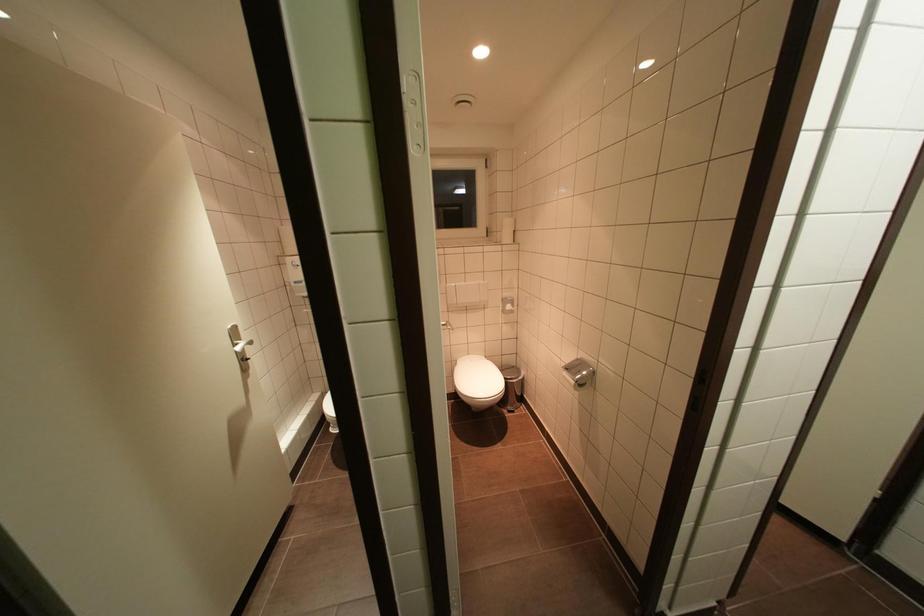
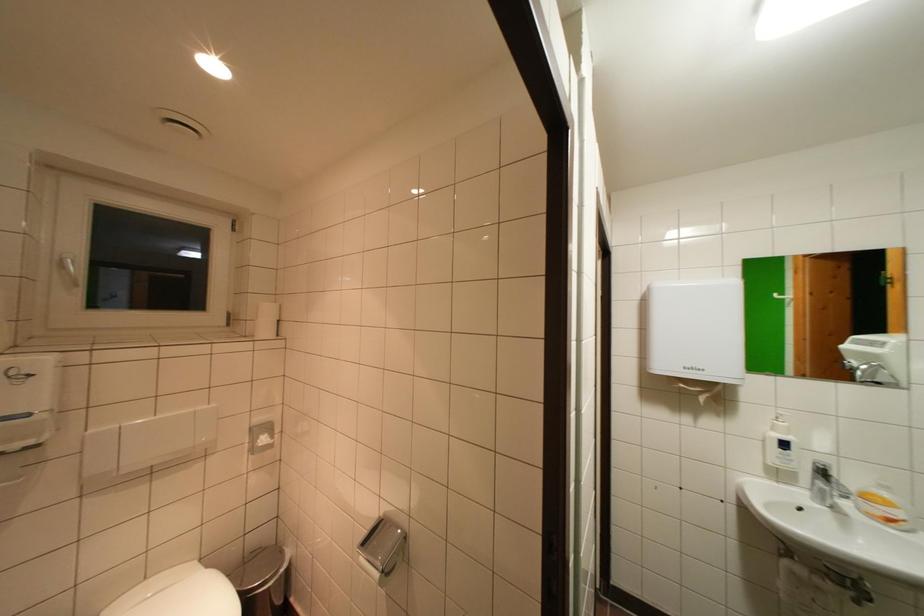
Where in the second image is the point corresponding to point (514, 240) from the first image?

(272, 331)